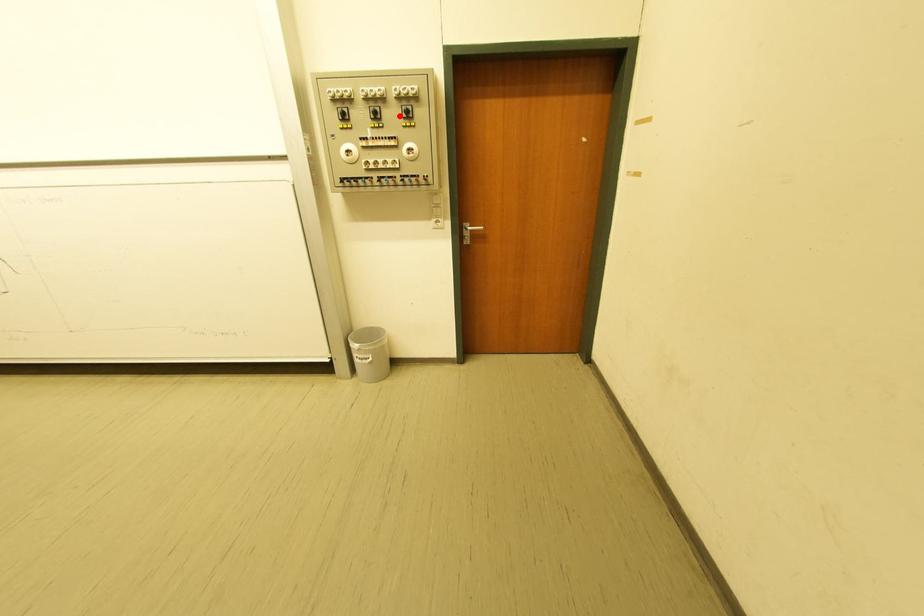
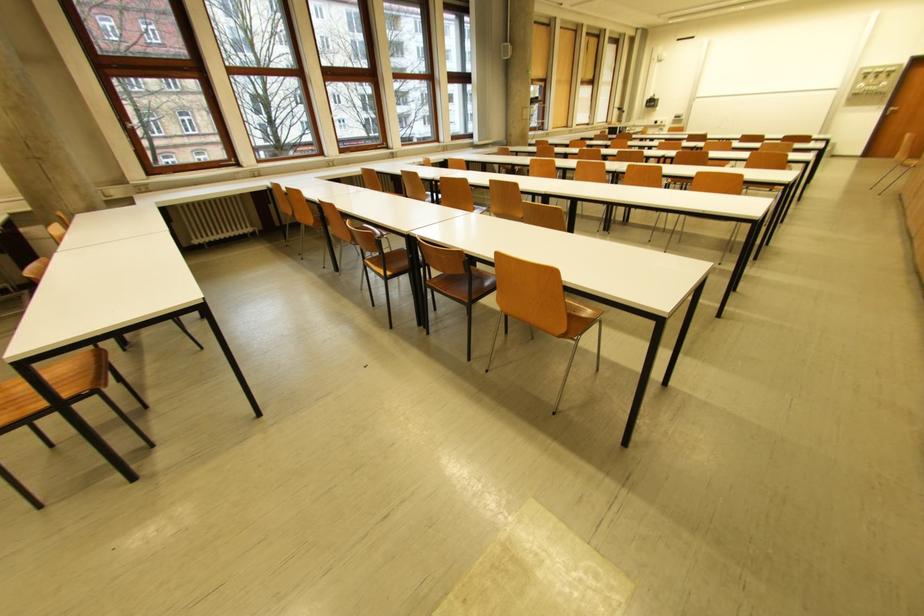
Question: I am providing you with two images of the same scene from different viewpoints. Image1 has a red point marked. In image2, the corresponding 3D location appears at what relative position? Reply with the corresponding letter.

Choices:
 (A) Closer
 (B) Farther

Answer: (B)